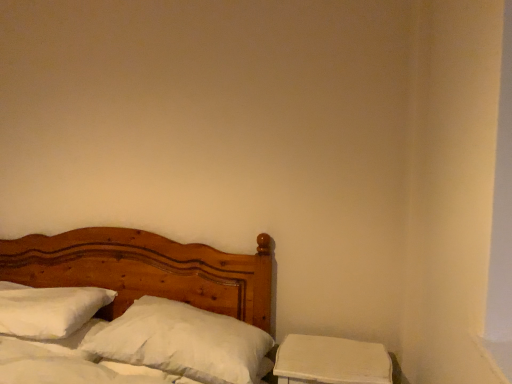
At what (x,y) coordinates should I click in order to perform the action: click on white soft pillow at left, the second pillow in the right-to-left sequence. Please return your answer as a coordinate pair (x, y). This screenshot has width=512, height=384. Looking at the image, I should click on (48, 310).

Locate an element on the screen. The height and width of the screenshot is (384, 512). wooden bed at left is located at coordinates (146, 270).

The image size is (512, 384). Identify the location of white matte nightstand at lower right. (331, 361).

Describe the element at coordinates (184, 342) in the screenshot. I see `white soft pillow at center, which is the 1th pillow in right-to-left order` at that location.

Find the location of a particular element. The image size is (512, 384). white soft pillow at left, acting as the 1th pillow starting from the left is located at coordinates (48, 310).

Who is taller, wooden bed at left or white soft pillow at center, which is the 1th pillow in right-to-left order?

wooden bed at left is taller.

Is there a large distance between wooden bed at left and white soft pillow at center, which is the 1th pillow in right-to-left order?

wooden bed at left is actually quite close to white soft pillow at center, which is the 1th pillow in right-to-left order.

From a real-world perspective, is wooden bed at left positioned above or below white soft pillow at center, which is the 1th pillow in right-to-left order?

wooden bed at left is situated lower than white soft pillow at center, which is the 1th pillow in right-to-left order, in the real world.

Is point (184, 251) less distant than point (250, 356)?

No, (184, 251) is behind (250, 356).

Between wooden bed at left and white soft pillow at left, the second pillow in the right-to-left sequence, which one appears on the right side from the viewer's perspective?

wooden bed at left is more to the right.

Is wooden bed at left in front of or behind white soft pillow at left, the second pillow in the right-to-left sequence, in the image?

Clearly, wooden bed at left is in front of white soft pillow at left, the second pillow in the right-to-left sequence.

Is point (87, 267) less distant than point (47, 293)?

No, (87, 267) is behind (47, 293).

Is the surface of white soft pillow at left, the second pillow in the right-to-left sequence, in direct contact with white matte nightstand at lower right?

No, white soft pillow at left, the second pillow in the right-to-left sequence, is not in contact with white matte nightstand at lower right.

Which object is positioned more to the right, white soft pillow at left, acting as the 1th pillow starting from the left, or white matte nightstand at lower right?

white matte nightstand at lower right.

From the image's perspective, which one is positioned lower, white soft pillow at left, acting as the 1th pillow starting from the left, or white matte nightstand at lower right?

white matte nightstand at lower right appears lower in the image.

Is point (35, 293) closer to camera compared to point (307, 345)?

No, it is not.

Would you say white matte nightstand at lower right is outside white soft pillow at center, the 2th pillow from the left?

→ Yes.

How different are the orientations of white matte nightstand at lower right and white soft pillow at center, the 2th pillow from the left, in degrees?

There is a 1.89-degree angle between the facing directions of white matte nightstand at lower right and white soft pillow at center, the 2th pillow from the left.

Which of these two, white matte nightstand at lower right or white soft pillow at center, which is the 1th pillow in right-to-left order, stands shorter?

white soft pillow at center, which is the 1th pillow in right-to-left order.

Is white matte nightstand at lower right in front of or behind white soft pillow at center, the 2th pillow from the left, in the image?

white matte nightstand at lower right is in front of white soft pillow at center, the 2th pillow from the left.

Is white matte nightstand at lower right turned away from white soft pillow at left, acting as the 1th pillow starting from the left?

white matte nightstand at lower right is not turned away from white soft pillow at left, acting as the 1th pillow starting from the left.

Does white matte nightstand at lower right have a lesser width compared to white soft pillow at left, the second pillow in the right-to-left sequence?

Yes, white matte nightstand at lower right is thinner than white soft pillow at left, the second pillow in the right-to-left sequence.

Starting from the white matte nightstand at lower right, which pillow is the 2nd one to the left? Please provide its 2D coordinates.

[(48, 310)]

Which object is wider, white soft pillow at left, the second pillow in the right-to-left sequence, or white soft pillow at center, the 2th pillow from the left?

white soft pillow at center, the 2th pillow from the left.

How far apart are white soft pillow at left, acting as the 1th pillow starting from the left, and white soft pillow at center, the 2th pillow from the left?

white soft pillow at left, acting as the 1th pillow starting from the left, is 37.18 centimeters from white soft pillow at center, the 2th pillow from the left.

Who is shorter, white soft pillow at left, acting as the 1th pillow starting from the left, or white soft pillow at center, which is the 1th pillow in right-to-left order?

With less height is white soft pillow at left, acting as the 1th pillow starting from the left.

Considering the sizes of objects white soft pillow at left, the second pillow in the right-to-left sequence, and white soft pillow at center, which is the 1th pillow in right-to-left order, in the image provided, who is bigger, white soft pillow at left, the second pillow in the right-to-left sequence, or white soft pillow at center, which is the 1th pillow in right-to-left order,?

white soft pillow at center, which is the 1th pillow in right-to-left order.

Considering the positions of objects white matte nightstand at lower right and wooden bed at left in the image provided, who is in front, white matte nightstand at lower right or wooden bed at left?

wooden bed at left is in front.

Which of these two, white matte nightstand at lower right or wooden bed at left, is smaller?

Smaller between the two is white matte nightstand at lower right.

Considering the relative sizes of white matte nightstand at lower right and wooden bed at left in the image provided, is white matte nightstand at lower right shorter than wooden bed at left?

Indeed, white matte nightstand at lower right has a lesser height compared to wooden bed at left.

Based on the photo, is white matte nightstand at lower right situated inside wooden bed at left or outside?

white matte nightstand at lower right lies outside wooden bed at left.

At what (x,y) coordinates should I click in order to perform the action: click on bed lying on the left of white soft pillow at center, the 2th pillow from the left. Please return your answer as a coordinate pair (x, y). This screenshot has height=384, width=512. Looking at the image, I should click on (146, 270).

Find the location of a particular element. bed below the white soft pillow at left, the second pillow in the right-to-left sequence (from the image's perspective) is located at coordinates (146, 270).

Which object lies further to the anchor point white matte nightstand at lower right, white soft pillow at left, acting as the 1th pillow starting from the left, or white soft pillow at center, the 2th pillow from the left?

Among the two, white soft pillow at left, acting as the 1th pillow starting from the left, is located further to white matte nightstand at lower right.

From the image, which object appears to be farther from wooden bed at left, white soft pillow at left, acting as the 1th pillow starting from the left, or white soft pillow at center, which is the 1th pillow in right-to-left order?

white soft pillow at center, which is the 1th pillow in right-to-left order, is further to wooden bed at left.

Based on their spatial positions, is wooden bed at left or white matte nightstand at lower right further from white soft pillow at center, which is the 1th pillow in right-to-left order?

wooden bed at left.

Estimate the real-world distances between objects in this image. Which object is closer to white soft pillow at left, acting as the 1th pillow starting from the left, white soft pillow at center, the 2th pillow from the left, or white matte nightstand at lower right?

white soft pillow at center, the 2th pillow from the left.

Considering their positions, is wooden bed at left positioned further to white matte nightstand at lower right than white soft pillow at center, the 2th pillow from the left?

The object further to white matte nightstand at lower right is wooden bed at left.

When comparing their distances from wooden bed at left, does white matte nightstand at lower right or white soft pillow at left, the second pillow in the right-to-left sequence, seem further?

white matte nightstand at lower right is positioned further to the anchor wooden bed at left.

Based on their spatial positions, is wooden bed at left or white soft pillow at center, the 2th pillow from the left, closer to white soft pillow at left, acting as the 1th pillow starting from the left?

wooden bed at left is closer to white soft pillow at left, acting as the 1th pillow starting from the left.

Looking at the image, which one is located further to white soft pillow at center, the 2th pillow from the left, white matte nightstand at lower right or white soft pillow at left, the second pillow in the right-to-left sequence?

Based on the image, white soft pillow at left, the second pillow in the right-to-left sequence, appears to be further to white soft pillow at center, the 2th pillow from the left.

The height and width of the screenshot is (384, 512). Find the location of `pillow between white soft pillow at left, acting as the 1th pillow starting from the left, and white matte nightstand at lower right from left to right`. pillow between white soft pillow at left, acting as the 1th pillow starting from the left, and white matte nightstand at lower right from left to right is located at coordinates (184, 342).

The height and width of the screenshot is (384, 512). Find the location of `bed between white soft pillow at left, the second pillow in the right-to-left sequence, and white matte nightstand at lower right from left to right`. bed between white soft pillow at left, the second pillow in the right-to-left sequence, and white matte nightstand at lower right from left to right is located at coordinates (146, 270).

Image resolution: width=512 pixels, height=384 pixels. I want to click on nightstand located between wooden bed at left and white soft pillow at center, the 2th pillow from the left, in the depth direction, so click(x=331, y=361).

At what (x,y) coordinates should I click in order to perform the action: click on pillow positioned between wooden bed at left and white soft pillow at left, the second pillow in the right-to-left sequence, from near to far. Please return your answer as a coordinate pair (x, y). The width and height of the screenshot is (512, 384). Looking at the image, I should click on (184, 342).